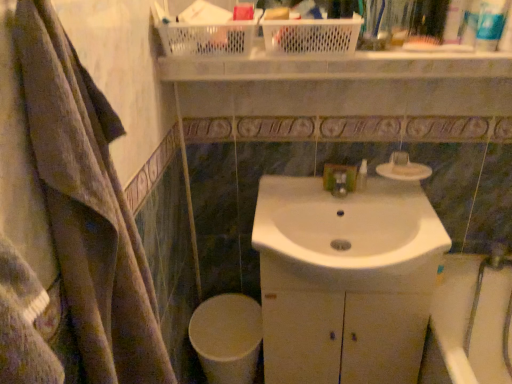
Question: From a real-world perspective, is translucent plastic bottle at upper right, which ranks as the third toiletry in front-to-back order, on white plastic toothpaste tube at upper right, the second toiletry from the bottom?

Choices:
 (A) yes
 (B) no

Answer: (A)

Question: Does translucent plastic bottle at upper right, which ranks as the third toiletry in front-to-back order, have a lesser height compared to white plastic toothpaste tube at upper right, which ranks as the 3th toiletry in top-to-bottom order?

Choices:
 (A) yes
 (B) no

Answer: (B)

Question: Is translucent plastic bottle at upper right, acting as the first toiletry starting from the top, oriented away from white plastic toothpaste tube at upper right, which is the 3th toiletry from back to front?

Choices:
 (A) yes
 (B) no

Answer: (B)

Question: Can you confirm if translucent plastic bottle at upper right, acting as the first toiletry starting from the top, is positioned to the left of white plastic toothpaste tube at upper right, the 3th toiletry positioned from the left?

Choices:
 (A) no
 (B) yes

Answer: (B)

Question: Is translucent plastic bottle at upper right, which ranks as the third toiletry in front-to-back order, thinner than white plastic toothpaste tube at upper right, which is the second toiletry from front to back?

Choices:
 (A) no
 (B) yes

Answer: (A)

Question: Does translucent plastic bottle at upper right, the 2th toiletry from the left, lie in front of white plastic toothpaste tube at upper right, the 3th toiletry positioned from the left?

Choices:
 (A) no
 (B) yes

Answer: (A)

Question: Can you confirm if white plastic toothpaste tube at upper right, the 3th toiletry positioned from the left, is taller than white textured bath towel at left?

Choices:
 (A) no
 (B) yes

Answer: (A)

Question: Does white plastic toothpaste tube at upper right, which is the second toiletry from front to back, have a greater width compared to white textured bath towel at left?

Choices:
 (A) yes
 (B) no

Answer: (B)

Question: Would you say white textured bath towel at left is part of white plastic toothpaste tube at upper right, the second toiletry in the right-to-left sequence,'s contents?

Choices:
 (A) no
 (B) yes

Answer: (A)

Question: Is white plastic toothpaste tube at upper right, which is the second toiletry from front to back, far away from white textured bath towel at left?

Choices:
 (A) no
 (B) yes

Answer: (B)

Question: Could you tell me if white plastic toothpaste tube at upper right, the 3th toiletry positioned from the left, is turned towards white textured bath towel at left?

Choices:
 (A) no
 (B) yes

Answer: (B)

Question: Is the depth of white plastic toothpaste tube at upper right, the second toiletry in the right-to-left sequence, greater than that of white textured bath towel at left?

Choices:
 (A) yes
 (B) no

Answer: (A)

Question: Is white glossy toilet bowl at lower center not close to white matte soap at upper center?

Choices:
 (A) no
 (B) yes

Answer: (A)